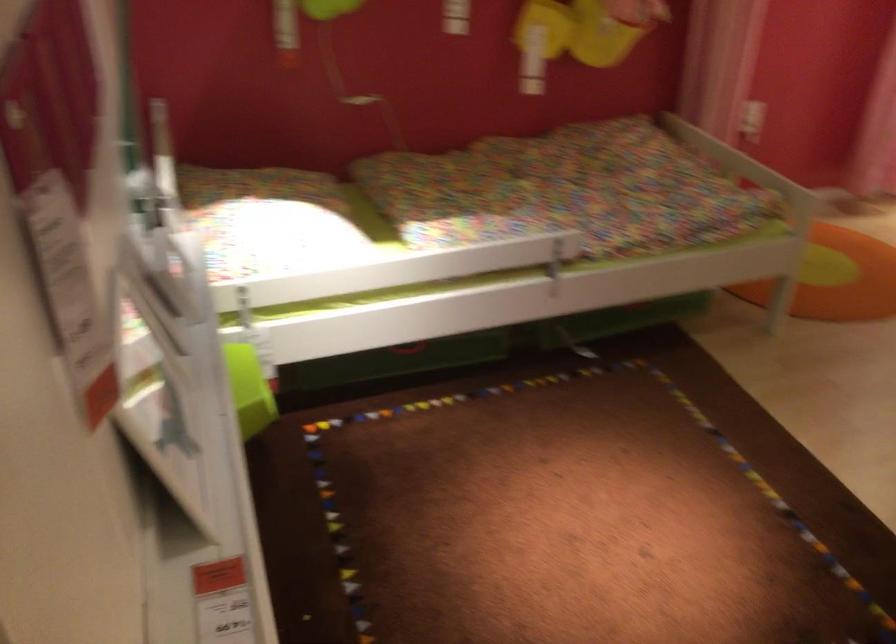
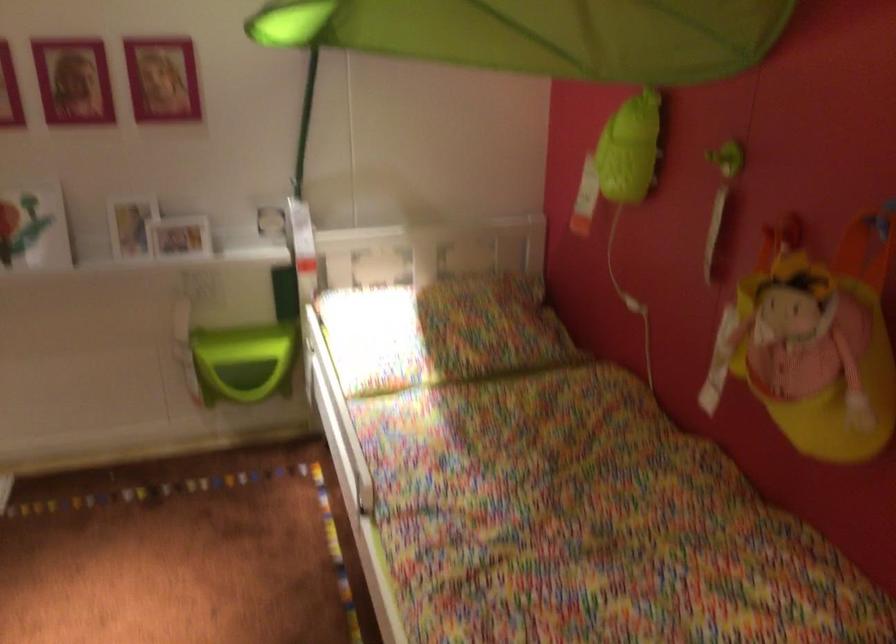
Find the pixel in the second image that matches (x=325, y=205) in the first image.

(440, 332)